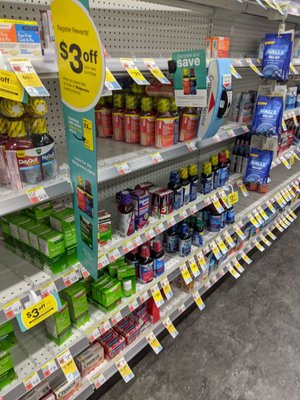
Locate an element on the screen. This screenshot has height=400, width=300. floor is located at coordinates pyautogui.click(x=236, y=348).